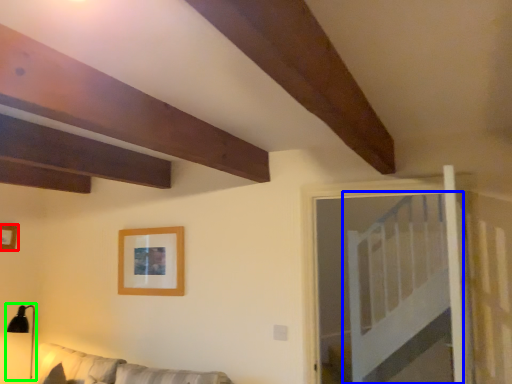
Question: Considering the real-world distances, which object is closest to picture frame (highlighted by a red box)? bed (highlighted by a blue box) or lamp (highlighted by a green box).

Choices:
 (A) bed
 (B) lamp

Answer: (B)